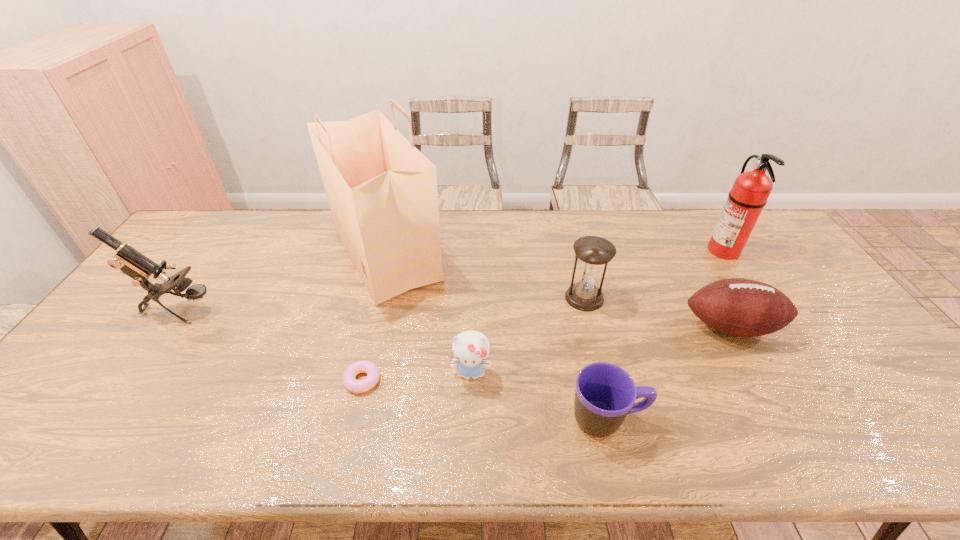
In order to click on grocery bag in this screenshot , I will do `click(382, 191)`.

Locate an element on the screen. This screenshot has width=960, height=540. fire extinguisher is located at coordinates (750, 191).

Find the location of a particular element. the leftmost object is located at coordinates (137, 266).

The height and width of the screenshot is (540, 960). What are the coordinates of `microscope` in the screenshot? It's located at (137, 266).

I want to click on hourglass, so click(593, 252).

The height and width of the screenshot is (540, 960). Identify the location of football (American). (741, 307).

Locate an element on the screen. kitten is located at coordinates (471, 348).

Locate an element on the screen. the nearest object is located at coordinates 605,394.

Where is `the shortest object`? Image resolution: width=960 pixels, height=540 pixels. the shortest object is located at coordinates [357, 386].

Identify the location of free space located 0.230m on the side of the grocery bag with the superhero design. The width and height of the screenshot is (960, 540). (516, 254).